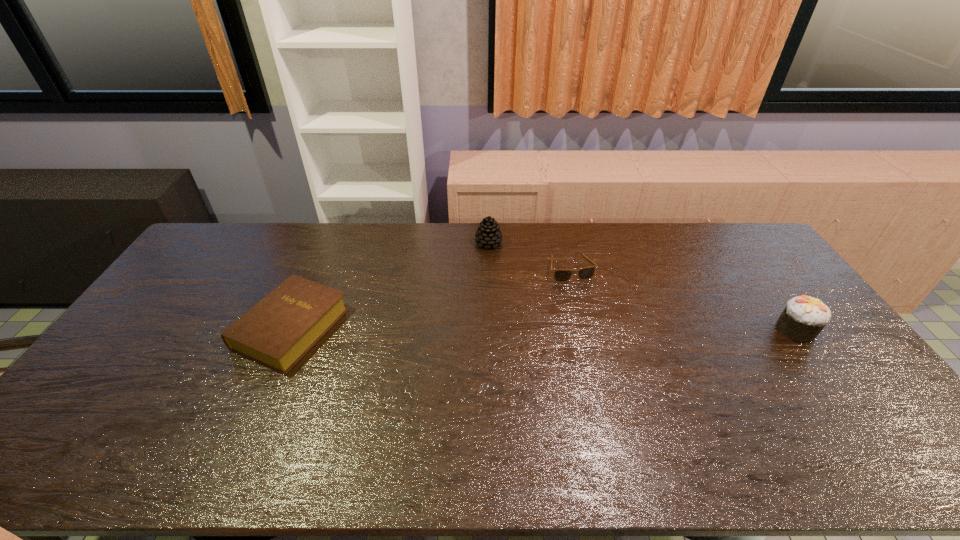
Identify the location of free spot on the desktop that is between the leftmost object and the rightmost object and is positioned at the narrow end of the third object from right to left. (573, 328).

Where is `vacant spot on the desktop that is between the leftmost object and the rightmost object and is positioned on the frames of the sunglasses`? vacant spot on the desktop that is between the leftmost object and the rightmost object and is positioned on the frames of the sunglasses is located at coordinates (598, 329).